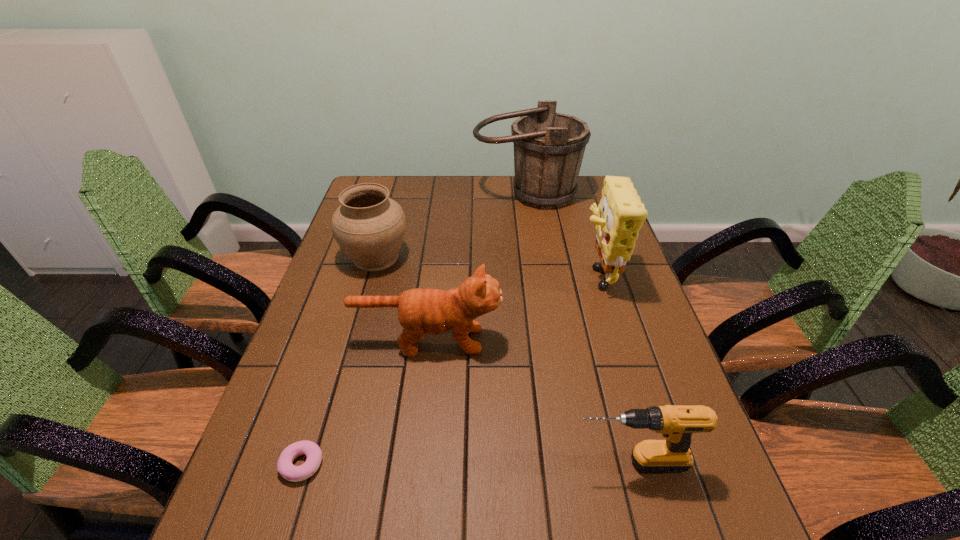
Locate an element on the screen. The height and width of the screenshot is (540, 960). bucket present at the right edge is located at coordinates (549, 147).

Find the location of a particular element. The image size is (960, 540). sponge that is at the right edge is located at coordinates (620, 215).

Find the location of `drill present at the right edge`. drill present at the right edge is located at coordinates (676, 423).

The width and height of the screenshot is (960, 540). Find the location of `object that is positioned at the far right corner`. object that is positioned at the far right corner is located at coordinates click(x=549, y=147).

This screenshot has width=960, height=540. I want to click on free region at the far edge of the desktop, so click(x=428, y=206).

In the image, there is a desktop. At what (x,y) coordinates should I click in order to perform the action: click on vacant space at the left edge. Please return your answer as a coordinate pair (x, y). Looking at the image, I should click on (329, 407).

In the image, there is a desktop. Identify the location of vacant space at the right edge. The image size is (960, 540). (652, 379).

The width and height of the screenshot is (960, 540). In the image, there is a desktop. What are the coordinates of `vacant space at the far right corner` in the screenshot? It's located at (580, 190).

Identify the location of vacant area that lies between the shortest object and the urn. (339, 361).

This screenshot has height=540, width=960. What are the coordinates of `unoccupied position between the pastry and the fifth tallest object` in the screenshot? It's located at (467, 463).